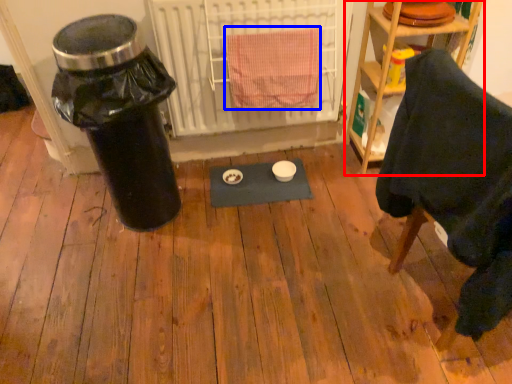
Question: Which point is further to the camera, shelf (highlighted by a red box) or bath towel (highlighted by a blue box)?

Choices:
 (A) shelf
 (B) bath towel

Answer: (A)